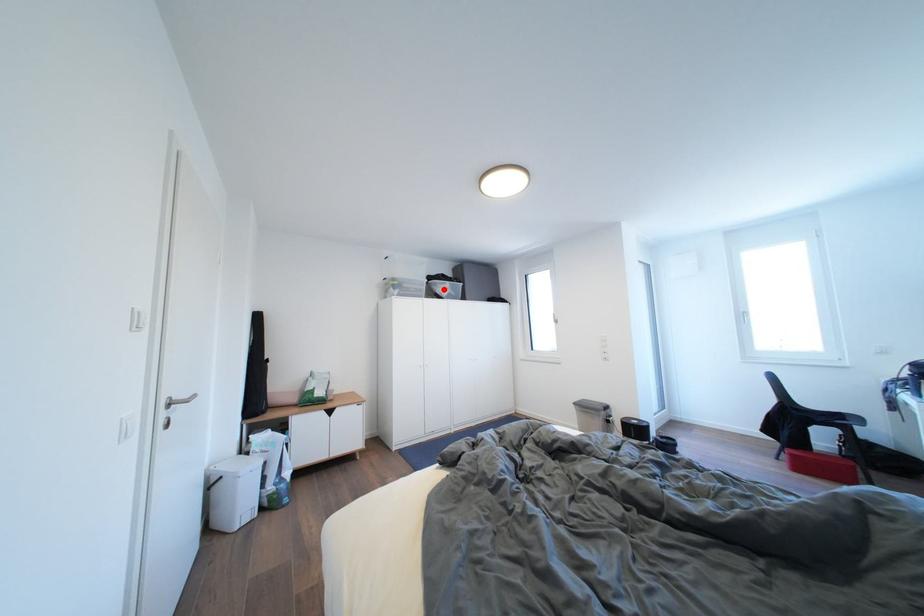
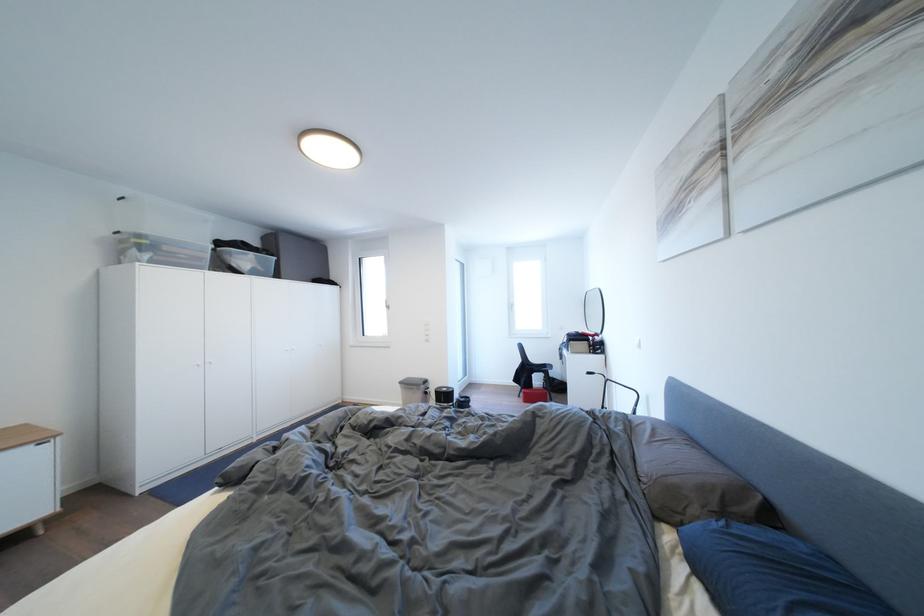
The point at the highlighted location is marked in the first image. Where is the corresponding point in the second image?

(237, 259)